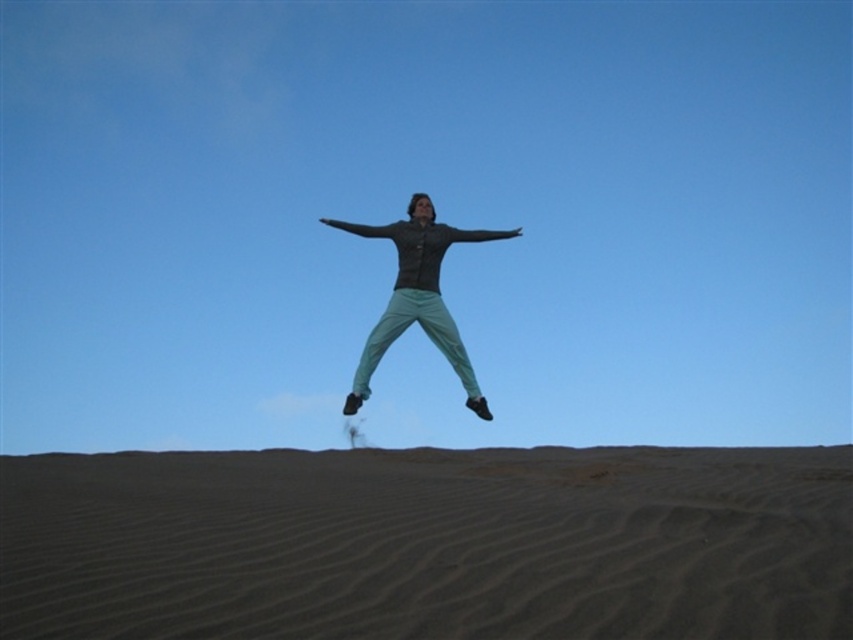
You are a photographer trying to capture the perfect shot of the person jumping. You notice the dark brown textured sand at lower center and the teal fabric pants at center. Which object is located directly beneath the other?

The dark brown textured sand at lower center is positioned under the teal fabric pants at center, so the sand is directly beneath the pants.

You are a photographer trying to capture the perfect shot of the person midair. You want to ensure the dark brown textured sand at lower center is visible in the background. Based on its position, can you confirm if the sand will be in the frame?

The dark brown textured sand at lower center is located at point (x=428, y=545), which is within the frame, so it will be visible in the background.

You are a photographer trying to capture the perfect shot of the person jumping. You notice a point labeled as point (428, 545) in the image. Based on the scene description, where is this point located in relation to the sand dune?

The point (428, 545) is located at the dark brown textured sand at lower center of the sand dune.